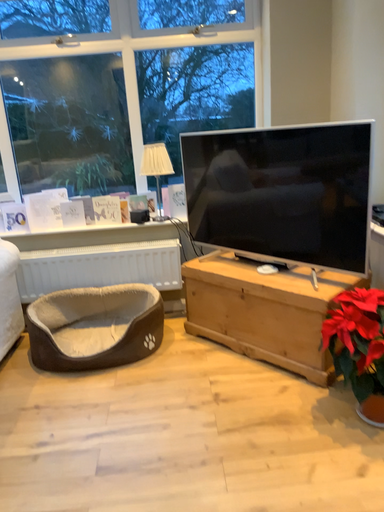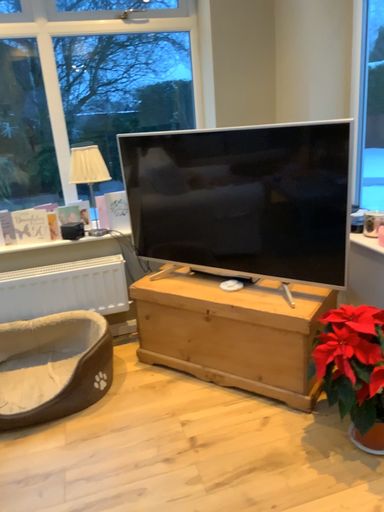
Question: How did the camera likely rotate when shooting the video?

Choices:
 (A) rotated left
 (B) rotated right

Answer: (B)